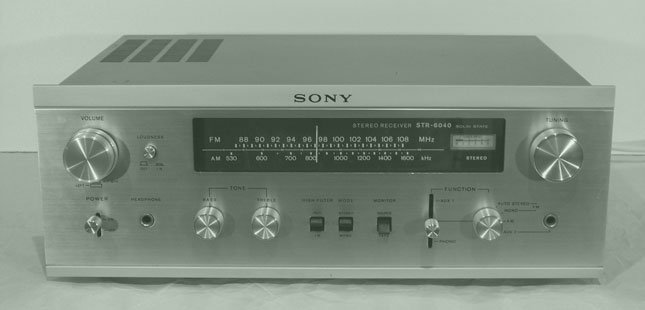
The height and width of the screenshot is (310, 645). Find the location of `wall`. wall is located at coordinates (26, 59).